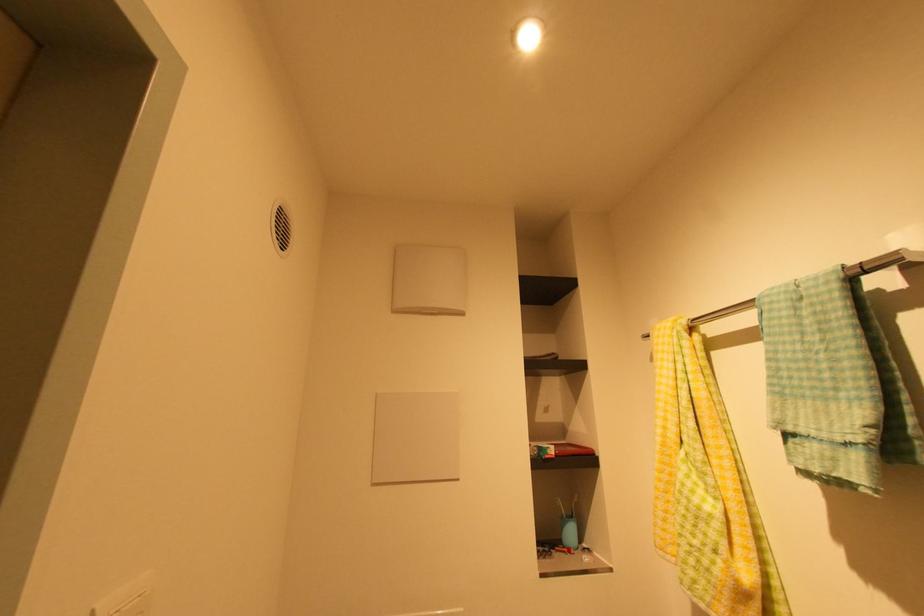
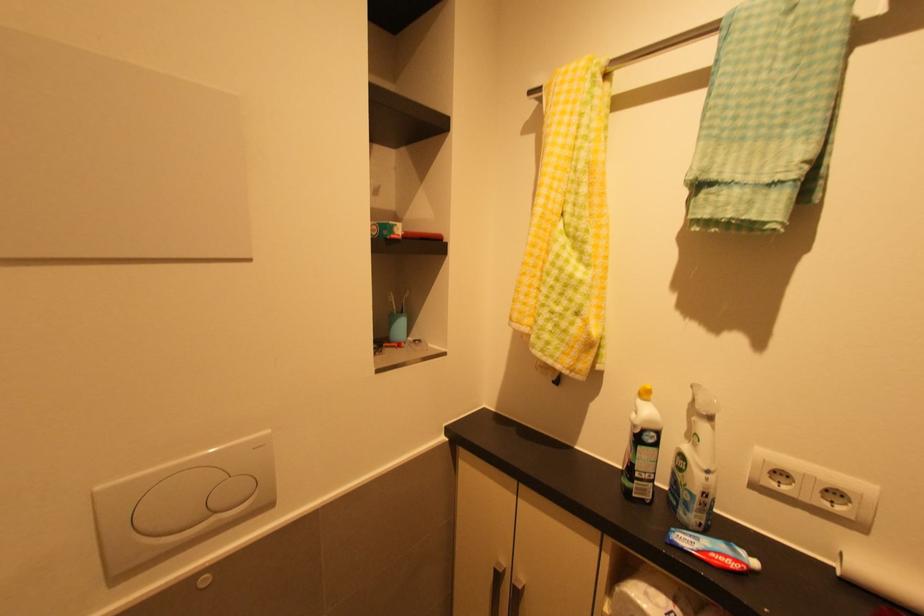
Based on the continuous images, in which direction is the camera rotating?

The rotation direction of the camera is right-down.